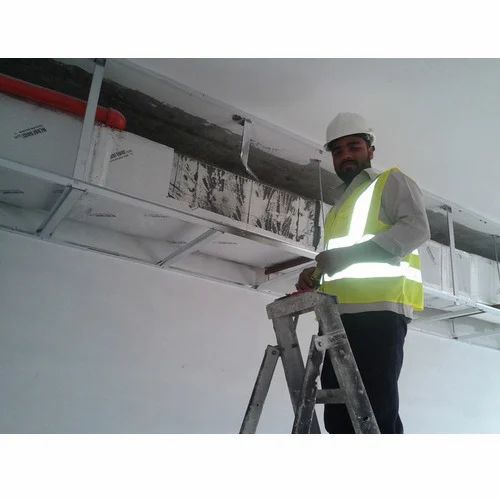
The height and width of the screenshot is (500, 500). In order to click on white background wall in this screenshot , I will do `click(176, 361)`.